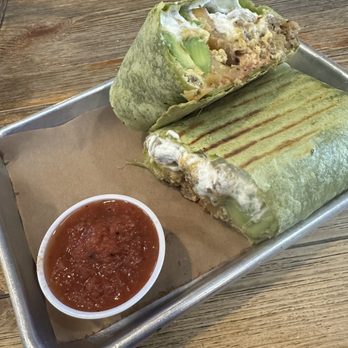
Where is `white bowl`? white bowl is located at coordinates (154, 278).